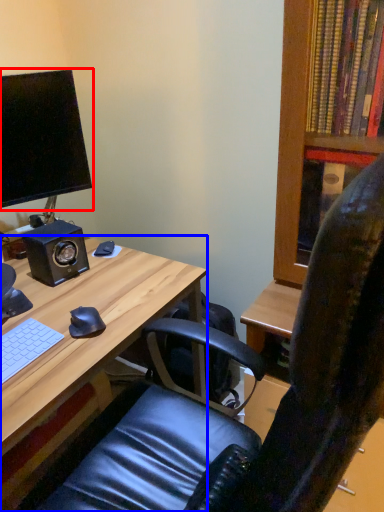
Question: Which object is closer to the camera taking this photo, computer monitor (highlighted by a red box) or desk (highlighted by a blue box)?

Choices:
 (A) computer monitor
 (B) desk

Answer: (B)